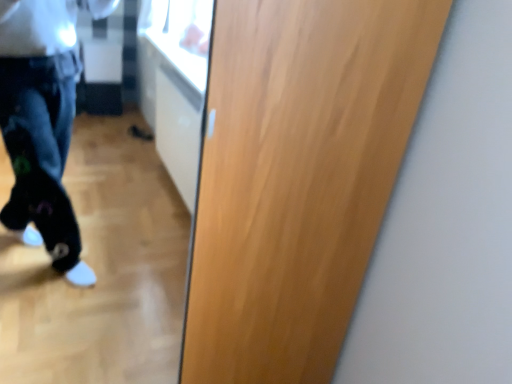
The image size is (512, 384). Describe the element at coordinates (297, 177) in the screenshot. I see `wooden door at center` at that location.

Measure the distance between point [196,252] and camera.

The distance of point [196,252] from camera is 37.87 inches.

Locate an element on the screen. wooden door at center is located at coordinates (297, 177).

I want to click on wooden door at center, so click(x=297, y=177).